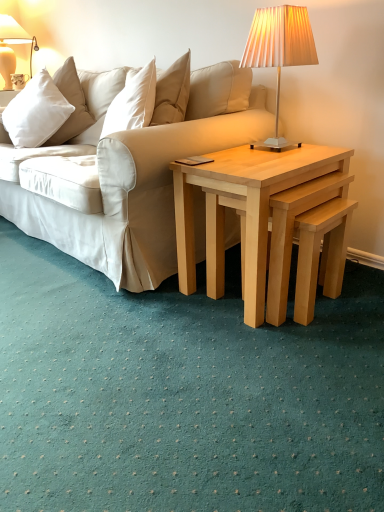
What are the coordinates of `vacant space in front of matte cream lampshade at upper right, the 1th lamp viewed from the front` in the screenshot? It's located at (283, 157).